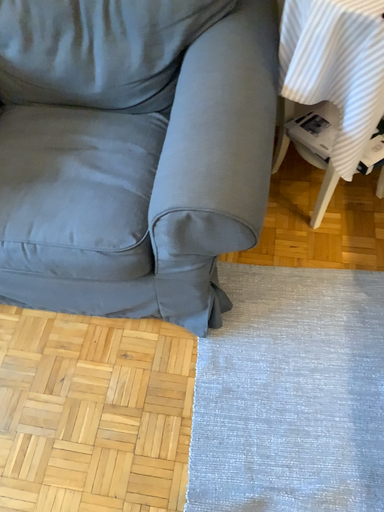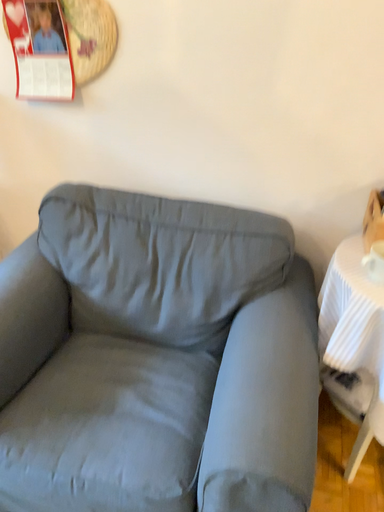
Question: Which way did the camera rotate in the video?

Choices:
 (A) rotated upward
 (B) rotated downward

Answer: (A)